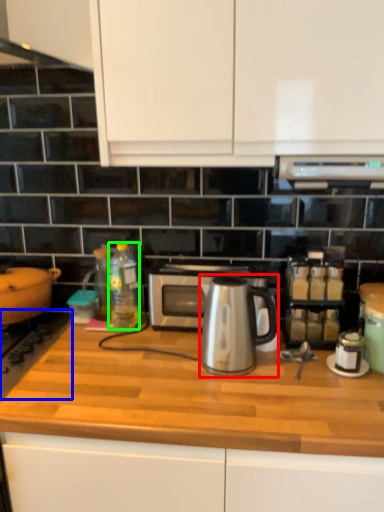
Question: Considering the real-world distances, which object is closest to coffeepot (highlighted by a red box)? gas stove (highlighted by a blue box) or bottle (highlighted by a green box).

Choices:
 (A) gas stove
 (B) bottle

Answer: (B)